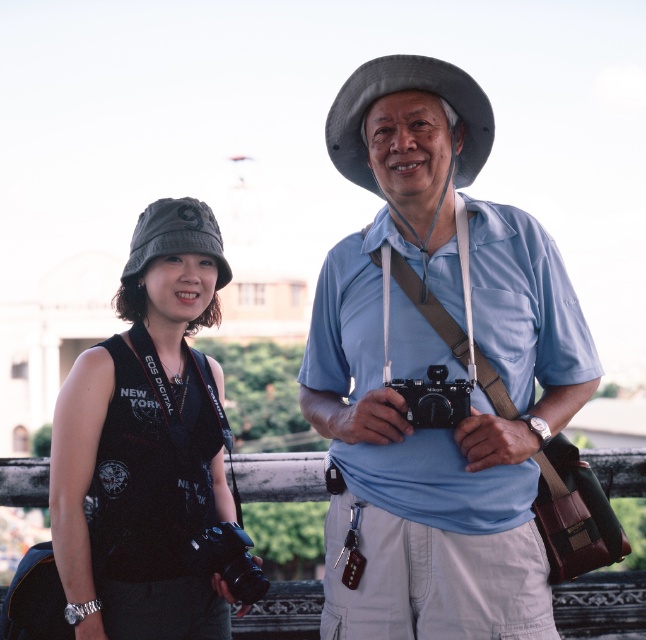
Is gray fabric cowboy hat at center behind black plastic camera at center?

Yes, gray fabric cowboy hat at center is further from the viewer.

Which of these two, gray fabric cowboy hat at center or black plastic camera at center, stands taller?

With more height is gray fabric cowboy hat at center.

Where is `gray fabric cowboy hat at center`? The image size is (646, 640). gray fabric cowboy hat at center is located at coordinates (401, 90).

Who is positioned more to the left, matte blue shirt at center or gray fabric cowboy hat at center?

Positioned to the left is gray fabric cowboy hat at center.

Does matte blue shirt at center appear on the right side of gray fabric cowboy hat at center?

Indeed, matte blue shirt at center is positioned on the right side of gray fabric cowboy hat at center.

Is point (422, 557) less distant than point (390, 74)?

That is True.

At what (x,y) coordinates should I click in order to perform the action: click on matte blue shirt at center. Please return your answer as a coordinate pair (x, y). This screenshot has height=640, width=646. Looking at the image, I should click on (474, 390).

Who is more forward, (x=413, y=442) or (x=417, y=406)?

Point (x=417, y=406) is more forward.

Is point (430, 442) behind point (435, 417)?

That is True.

Where is `matte blue shirt at center`? Image resolution: width=646 pixels, height=640 pixels. matte blue shirt at center is located at coordinates (474, 390).